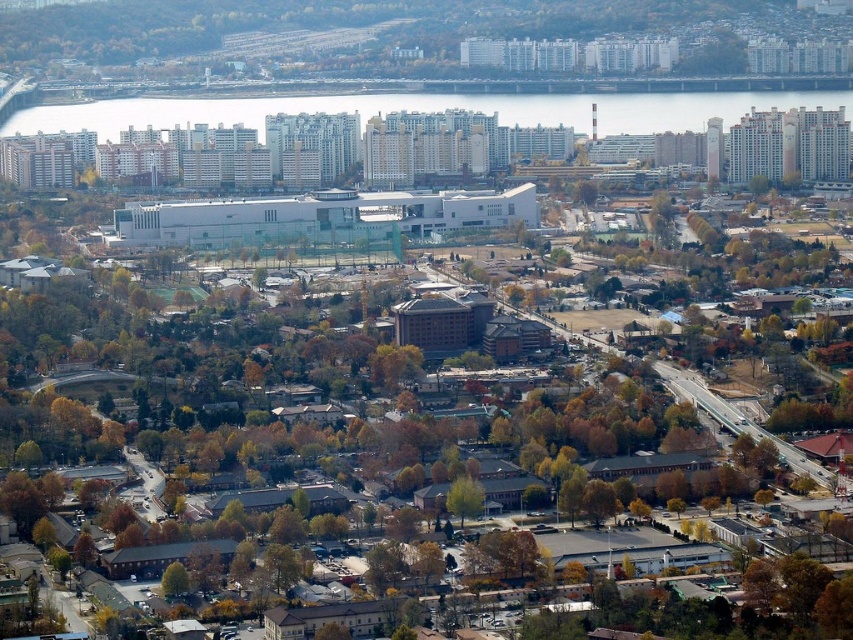
Based on the aerial view provided, what are the exact coordinates of the green leafy tree at center?

The green leafy tree at center is located at coordinates (463, 497).